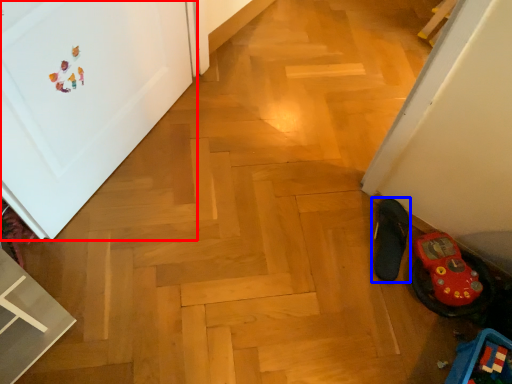
Question: Among these objects, which one is nearest to the camera, door (highlighted by a red box) or footwear (highlighted by a blue box)?

Choices:
 (A) door
 (B) footwear

Answer: (A)